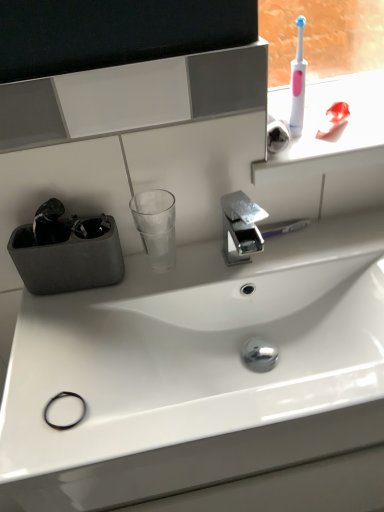
The height and width of the screenshot is (512, 384). I want to click on vacant space to the right of white plastic toothbrush at upper right, so click(x=355, y=122).